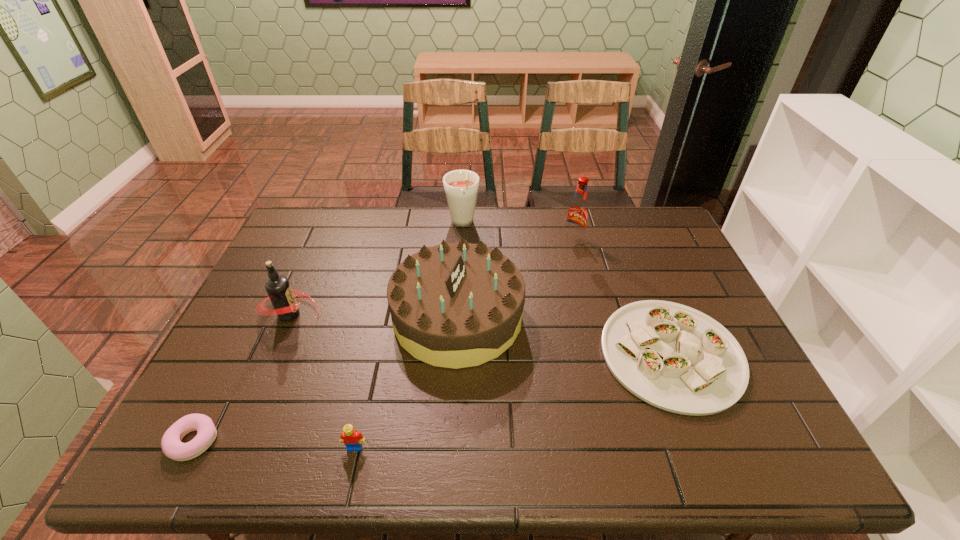
This screenshot has width=960, height=540. Find the location of `vacant space at the far edge`. vacant space at the far edge is located at coordinates (336, 242).

You are a GUI agent. You are given a task and a screenshot of the screen. Output one action in this format:
    pyautogui.click(x=<x>, y=<y>)
    Task: Click on the free space at the near edge of the desktop
    The width and height of the screenshot is (960, 540).
    Given the screenshot: What is the action you would take?
    point(478,443)

In the image, there is a desktop. At what (x,y) coordinates should I click in order to perform the action: click on vacant space at the left edge. Please return your answer as a coordinate pair (x, y). Looking at the image, I should click on (263, 396).

Locate an element on the screen. The width and height of the screenshot is (960, 540). free region at the near left corner is located at coordinates (239, 434).

This screenshot has width=960, height=540. I want to click on vacant position at the near right corner of the desktop, so click(725, 467).

The image size is (960, 540). Find the location of `empty space that is in between the platter and the rightmost root beer`. empty space that is in between the platter and the rightmost root beer is located at coordinates (622, 298).

The image size is (960, 540). What are the coordinates of `free space between the rightmost root beer and the sixth tallest object` in the screenshot? It's located at (622, 298).

This screenshot has height=540, width=960. In order to click on free space between the leftmost root beer and the second root beer from left to right in this screenshot , I will do `click(376, 269)`.

At what (x,y) coordinates should I click in order to perform the action: click on empty space between the third shortest object and the birthday cake. Please return your answer as a coordinate pair (x, y). The width and height of the screenshot is (960, 540). Looking at the image, I should click on (406, 382).

Locate an element on the screen. Image resolution: width=960 pixels, height=540 pixels. vacant space in between the birthday cake and the third shortest object is located at coordinates 406,382.